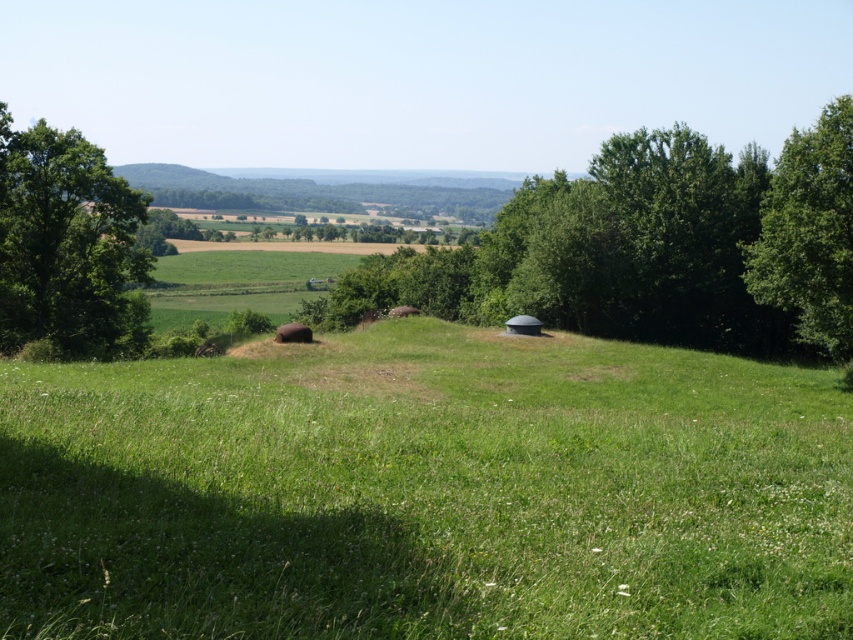
You are standing on the grassy hill in the image and want to walk towards the green leafy tree at right. Which direction should you head to reach it from the green grass at center?

To reach the green leafy tree at right from the green grass at center, you should head towards the right direction since the green grass at center is located below the green leafy tree at right, meaning the tree is positioned higher up on the slope relative to the grass.

You are a farmer planning to plant a new row of crops between the green leafy tree at center and the green leafy tree at left. Since you want the row to be evenly spaced between them, which tree should you use as the starting point to ensure the row is aligned properly?

The green leafy tree at center is shorter than the green leafy tree at left, so you should start from the taller green leafy tree at left to ensure the row is aligned properly.

You are a hiker standing on the grassy hill in the rural landscape. You see the green grass at center and the green leafy tree at left. Which object is closer to you based on their sizes?

The green grass at center is smaller in size compared to the green leafy tree at left, so it is closer to you.